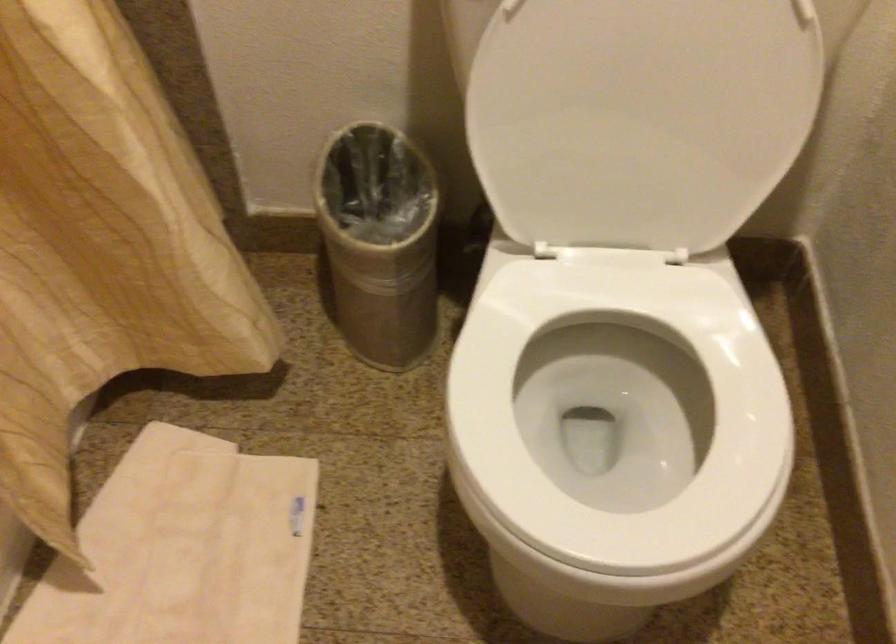
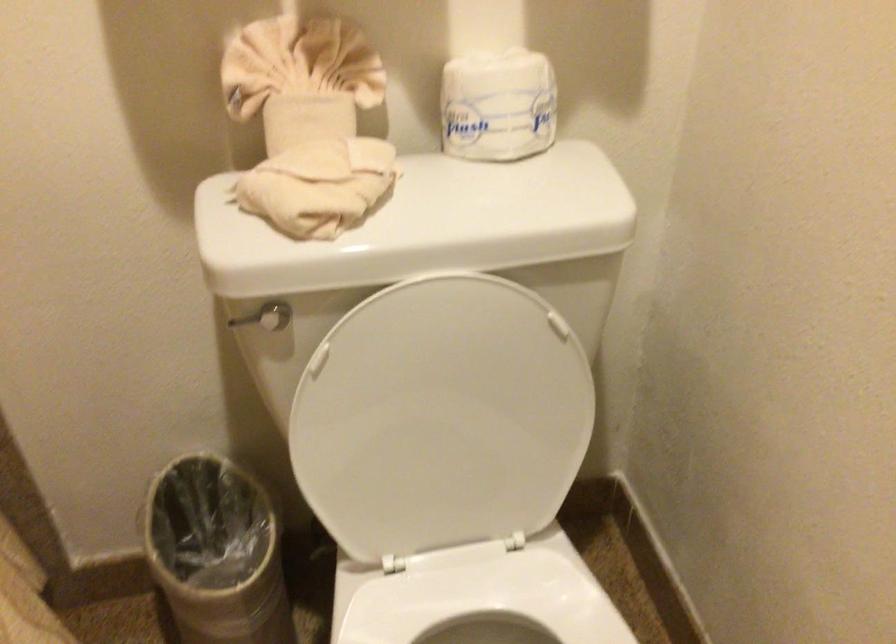
Question: The first image is from the beginning of the video and the second image is from the end. How did the camera likely rotate when shooting the video?

Choices:
 (A) Left
 (B) Right
 (C) Up
 (D) Down

Answer: (C)